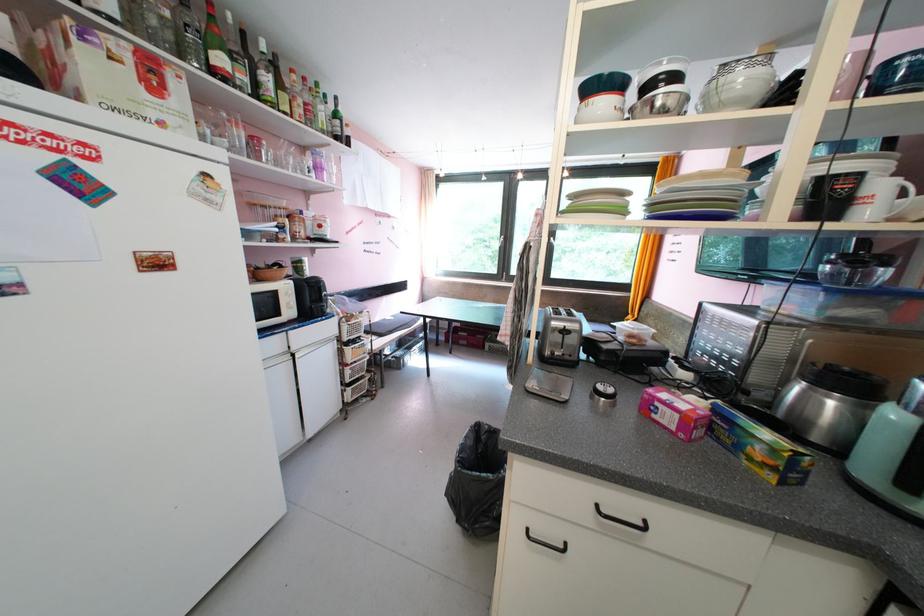
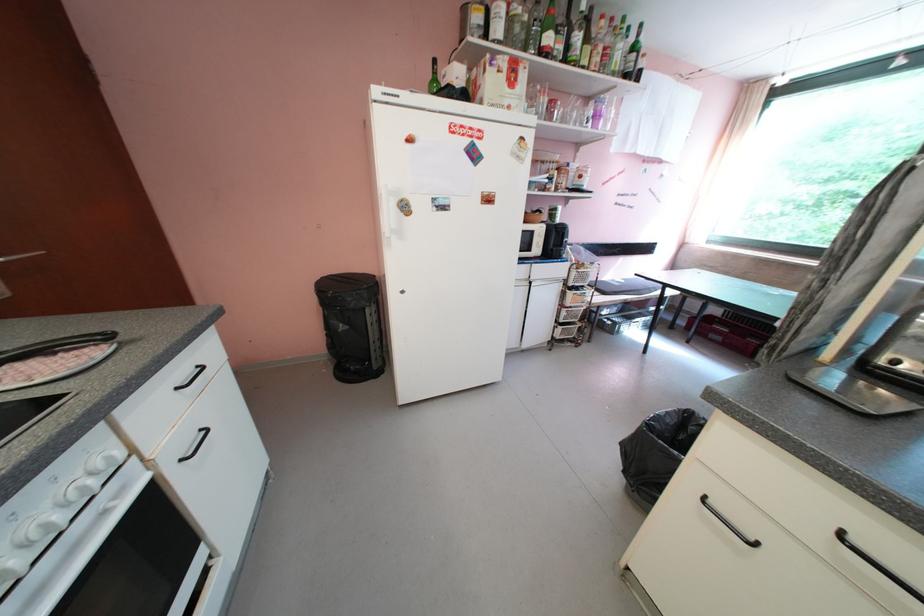
Question: The camera is either moving clockwise (left) or counter-clockwise (right) around the object. The first image is from the beginning of the video and the second image is from the end. Is the camera moving left or right when shooting the video?

Choices:
 (A) Left
 (B) Right

Answer: (B)